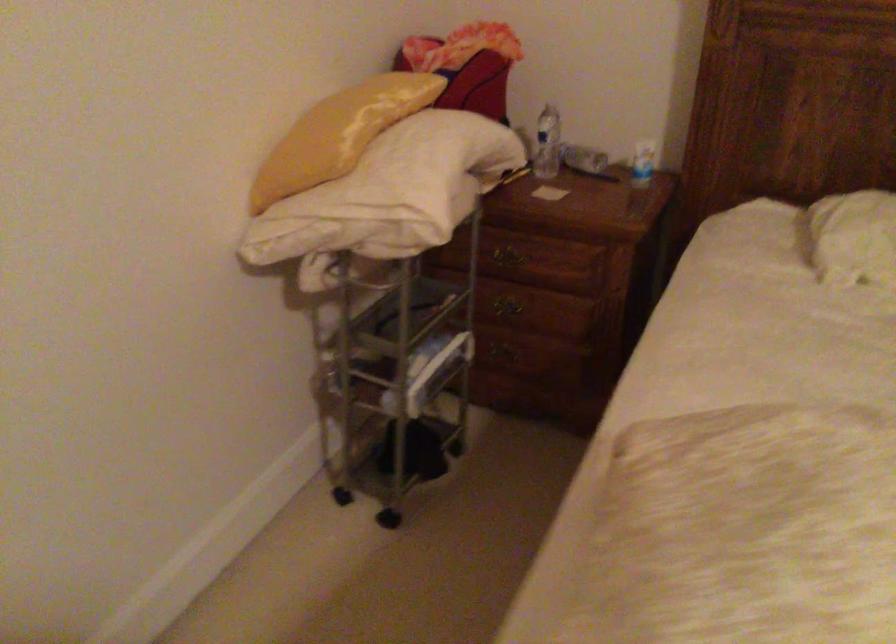
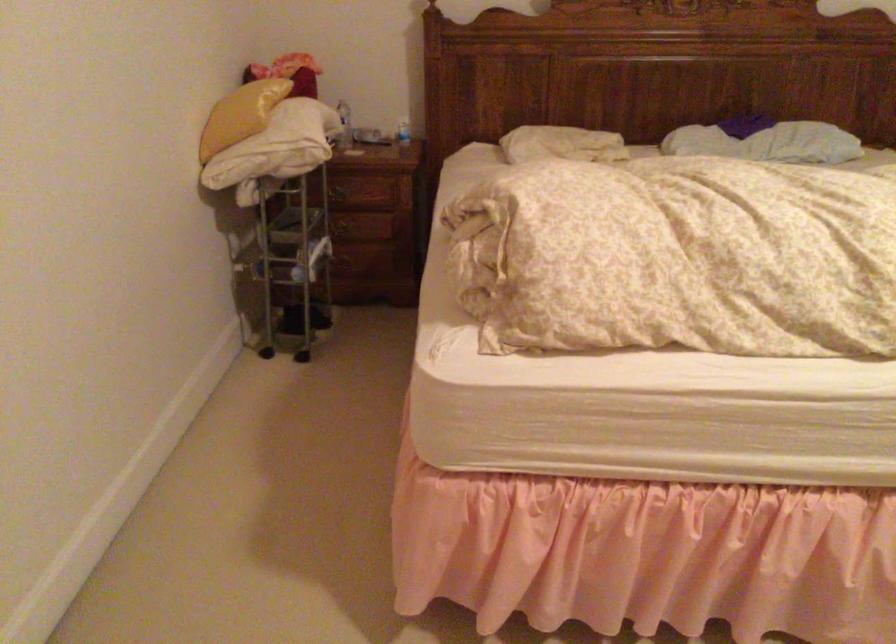
In the second image, find the point that corresponds to point (501, 313) in the first image.

(342, 230)